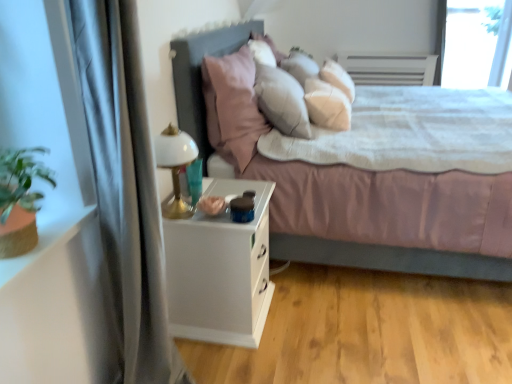
Question: In terms of size, does white glossy table lamp at left appear bigger or smaller than matte gray bed at center?

Choices:
 (A) big
 (B) small

Answer: (B)

Question: Is white glossy table lamp at left inside or outside of matte gray bed at center?

Choices:
 (A) inside
 (B) outside

Answer: (B)

Question: Based on their relative distances, which object is farther from the white glossy table lamp at left?

Choices:
 (A) transparent glass window screen at upper right
 (B) matte gray bed at center
 (C) white matte nightstand at lower left
 (D) pink fabric pillow at center
 (E) silky gray curtain at left

Answer: (A)

Question: Estimate the real-world distances between objects in this image. Which object is closer to the white matte nightstand at lower left?

Choices:
 (A) white glossy table lamp at left
 (B) silky gray curtain at left
 (C) matte gray bed at center
 (D) transparent glass window screen at upper right
 (E) pink fabric pillow at center

Answer: (A)